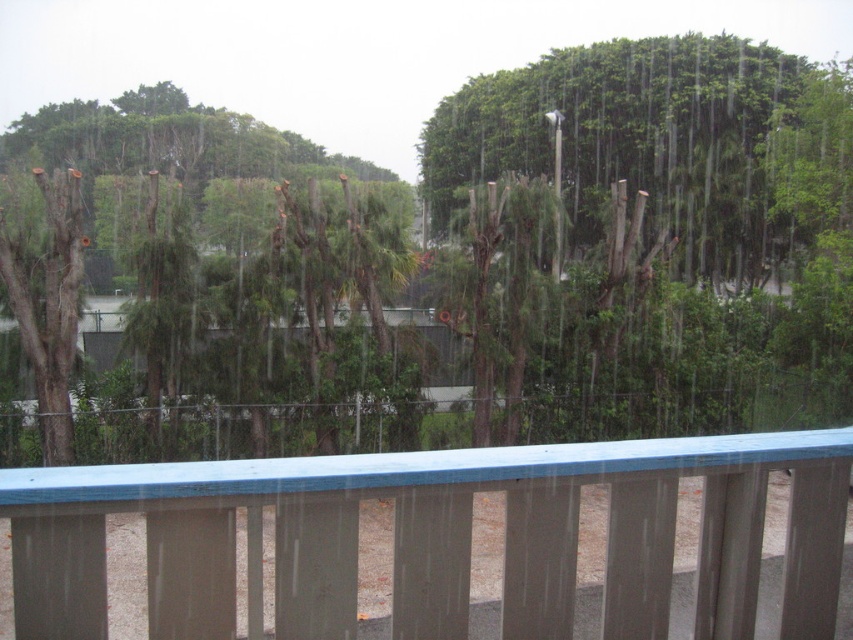
You are an architect designing a new balcony and want to ensure the green matte tree at center and the blue painted wood at center fit within a 3 meter wide space. Based on their widths, will both objects fit side by side?

The green matte tree at center is wider than the blue painted wood at center. However, without knowing the exact widths of both objects, it is impossible to determine if their combined width exceeds 3 meters. Additional measurements are needed.

You are standing on a balcony and want to place a small potted plant between the green matte tree at center and the blue painted wood at center. Based on their positions, which object should the potted plant be closer to?

The blue painted wood at center is behind the green matte tree at center, so the potted plant should be placed closer to the blue painted wood at center to maintain the spatial arrangement.